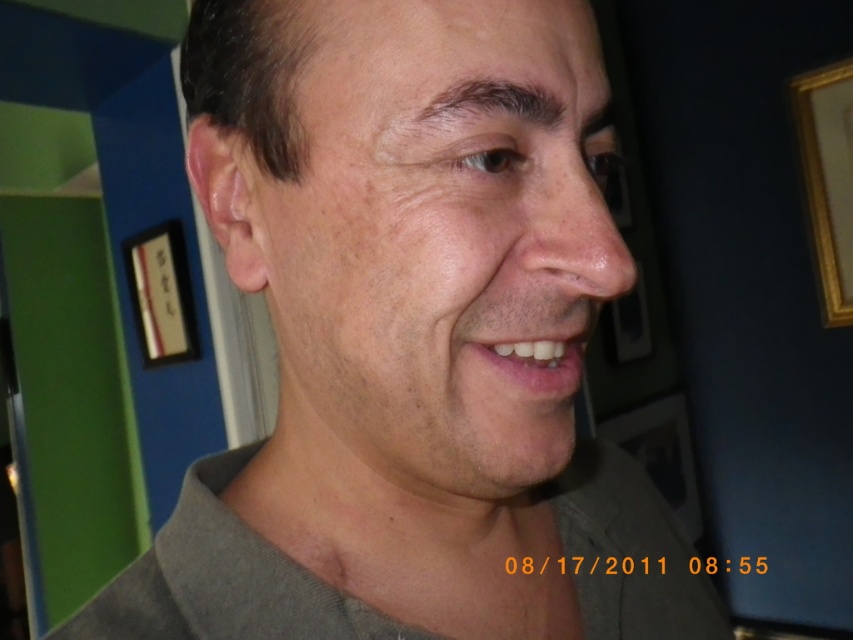
Question: Is smooth skin face at center positioned behind gold metallic picture frame at upper right?

Choices:
 (A) no
 (B) yes

Answer: (A)

Question: Which object is the closest to the gray fabric at lower center?

Choices:
 (A) gold metallic picture frame at upper right
 (B) smooth skin face at center
 (C) white glossy teeth at center
 (D) matte black picture frame at upper left

Answer: (B)

Question: Does gold metallic picture frame at upper right appear under white glossy teeth at center?

Choices:
 (A) no
 (B) yes

Answer: (A)

Question: Which point appears closest to the camera in this image?

Choices:
 (A) (318, 259)
 (B) (828, 301)
 (C) (160, 636)
 (D) (160, 348)

Answer: (A)

Question: Is gold metallic picture frame at upper right positioned at the back of white glossy teeth at center?

Choices:
 (A) no
 (B) yes

Answer: (B)

Question: Which object is positioned farthest from the matte black picture frame at upper left?

Choices:
 (A) gray fabric at lower center
 (B) gold metallic picture frame at upper right

Answer: (B)